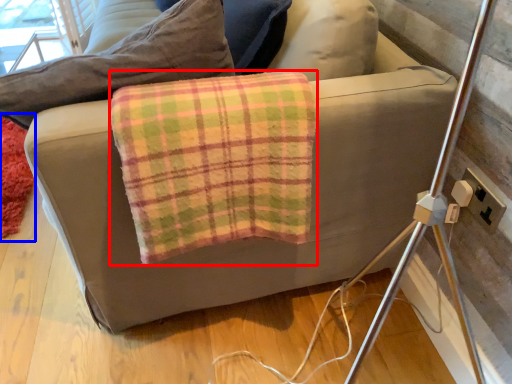
Question: Which object appears closest to the camera in this image, material (highlighted by a red box) or mat (highlighted by a blue box)?

Choices:
 (A) material
 (B) mat

Answer: (A)